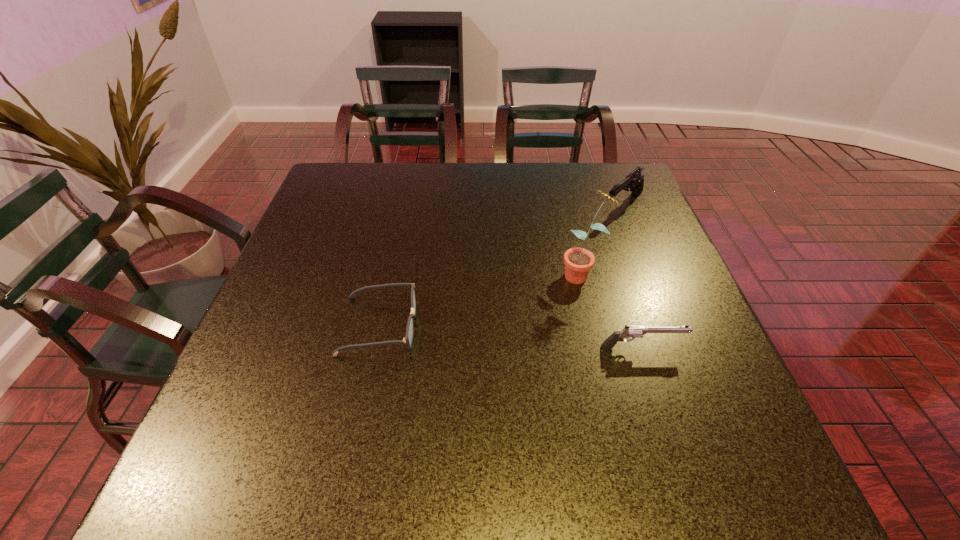
The image size is (960, 540). In order to click on free space on the desktop that is between the shortest object and the third tallest object and is positioned on the flower of the third nearest object in this screenshot , I will do `click(475, 334)`.

The height and width of the screenshot is (540, 960). I want to click on free space on the desktop that is between the shortest object and the third tallest object and is positioned at the end of the barrel of the second tallest object, so click(x=476, y=334).